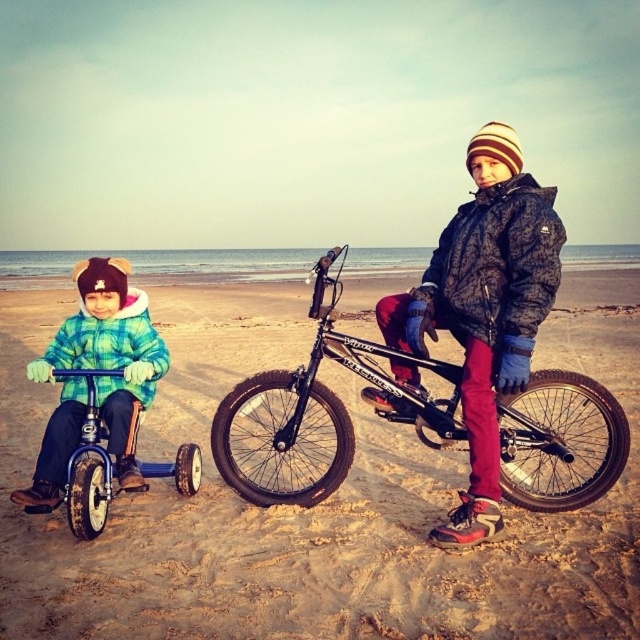
Question: Does shiny black bicycle at center appear on the left side of camouflage jacket at center?

Choices:
 (A) yes
 (B) no

Answer: (B)

Question: Which point is farther to the camera?

Choices:
 (A) blue plastic tricycle at left
 (B) matte black bicycle at center
 (C) shiny black bicycle at center
 (D) camouflage jacket at center

Answer: (D)

Question: Which of these objects is positioned closest to the camouflage jacket at center?

Choices:
 (A) flannel plaid jacket at left
 (B) matte black bicycle at center

Answer: (A)

Question: Is matte black bicycle at center to the right of blue plastic tricycle at left from the viewer's perspective?

Choices:
 (A) yes
 (B) no

Answer: (A)

Question: Which point is farther to the camera?

Choices:
 (A) (513, 433)
 (B) (61, 368)

Answer: (B)

Question: Can you confirm if camouflage jacket at center is positioned above flannel plaid jacket at left?

Choices:
 (A) yes
 (B) no

Answer: (A)